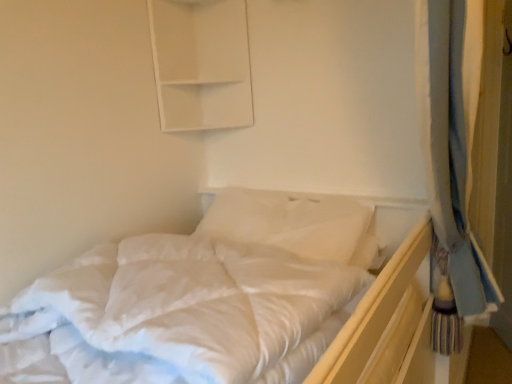
Question: Does white matte cabinet at upper center have a lesser width compared to white soft pillow at center?

Choices:
 (A) no
 (B) yes

Answer: (B)

Question: Is white matte cabinet at upper center far from white soft pillow at center?

Choices:
 (A) no
 (B) yes

Answer: (A)

Question: Is white matte cabinet at upper center not inside white soft pillow at center?

Choices:
 (A) yes
 (B) no

Answer: (A)

Question: Is the position of white matte cabinet at upper center more distant than that of white soft pillow at center?

Choices:
 (A) no
 (B) yes

Answer: (B)

Question: From the image's perspective, does white matte cabinet at upper center appear lower than white soft pillow at center?

Choices:
 (A) yes
 (B) no

Answer: (B)

Question: Can you confirm if white matte cabinet at upper center is bigger than white soft pillow at center?

Choices:
 (A) no
 (B) yes

Answer: (A)

Question: Considering the relative sizes of white soft pillow at center and white soft bed at center in the image provided, is white soft pillow at center shorter than white soft bed at center?

Choices:
 (A) no
 (B) yes

Answer: (A)

Question: Can you confirm if white soft pillow at center is thinner than white soft bed at center?

Choices:
 (A) yes
 (B) no

Answer: (A)

Question: Is white soft pillow at center bigger than white soft bed at center?

Choices:
 (A) no
 (B) yes

Answer: (A)

Question: From the image's perspective, is white soft pillow at center located beneath white soft bed at center?

Choices:
 (A) no
 (B) yes

Answer: (A)

Question: Can you confirm if white soft pillow at center is smaller than white soft bed at center?

Choices:
 (A) yes
 (B) no

Answer: (A)

Question: Is white soft bed at center inside white soft pillow at center?

Choices:
 (A) yes
 (B) no

Answer: (B)

Question: Is white soft bed at center in front of white soft pillow at center?

Choices:
 (A) no
 (B) yes

Answer: (B)